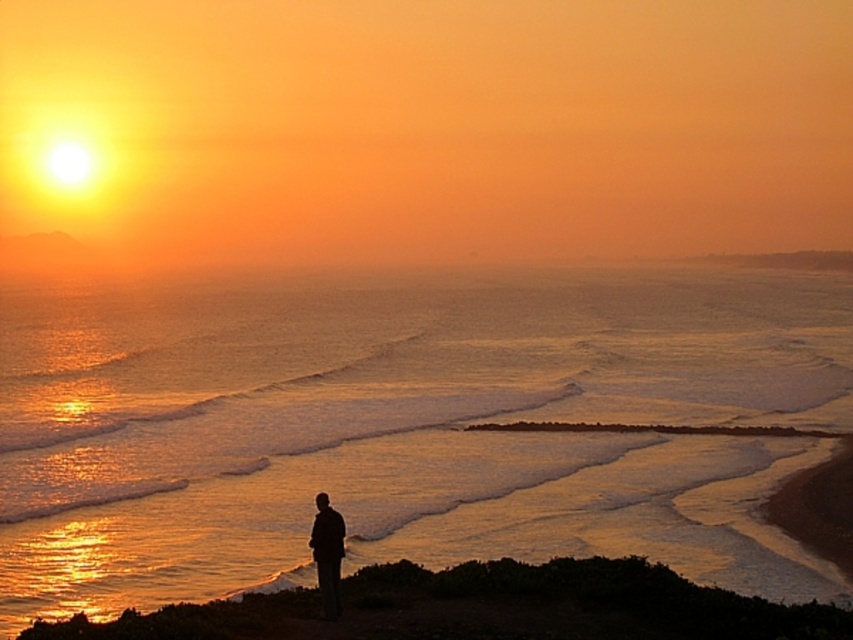
Which is in front, point (258, 340) or point (415, 596)?

Point (415, 596) is in front.

Can you confirm if glistening water at center is positioned to the right of smooth sand shoreline at lower center?

Incorrect, glistening water at center is not on the right side of smooth sand shoreline at lower center.

Does point (751, 412) come closer to viewer compared to point (660, 625)?

That is False.

The height and width of the screenshot is (640, 853). I want to click on glistening water at center, so click(404, 426).

This screenshot has width=853, height=640. What do you see at coordinates (480, 608) in the screenshot?
I see `smooth sand shoreline at lower center` at bounding box center [480, 608].

Which is more to the left, smooth sand shoreline at lower center or silhouette figure at lower center?

Positioned to the left is silhouette figure at lower center.

Where is `smooth sand shoreline at lower center`? The image size is (853, 640). smooth sand shoreline at lower center is located at coordinates (480, 608).

Is glistening water at center to the left of silhouette figure at lower center from the viewer's perspective?

Yes, glistening water at center is to the left of silhouette figure at lower center.

Is glistening water at center wider than silhouette figure at lower center?

Yes.

Where is `glistening water at center`? glistening water at center is located at coordinates (404, 426).

Locate an element on the screen. glistening water at center is located at coordinates (404, 426).